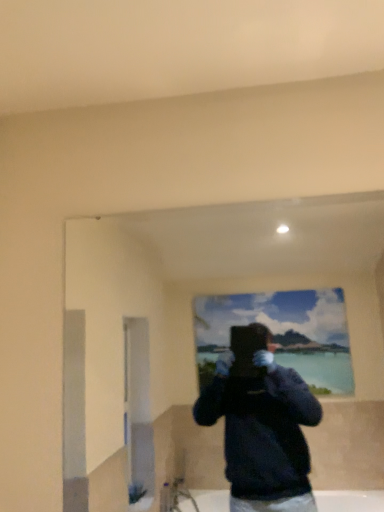
The image size is (384, 512). What do you see at coordinates (192, 315) in the screenshot?
I see `transparent glass mirror at upper center` at bounding box center [192, 315].

The width and height of the screenshot is (384, 512). I want to click on transparent glass mirror at upper center, so click(x=192, y=315).

Where is `transparent glass mirror at upper center`? Image resolution: width=384 pixels, height=512 pixels. transparent glass mirror at upper center is located at coordinates (192, 315).